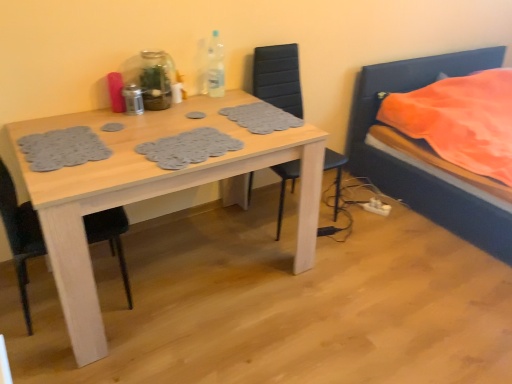
Question: From the image's perspective, is white plastic power plugs and sockets at lower right below black matte chair at left, which appears as the second chair when viewed from the right?

Choices:
 (A) no
 (B) yes

Answer: (B)

Question: From a real-world perspective, does white plastic power plugs and sockets at lower right stand above black matte chair at left, which ranks as the 1th chair in left-to-right order?

Choices:
 (A) no
 (B) yes

Answer: (A)

Question: Is white plastic power plugs and sockets at lower right positioned in front of black matte chair at left, which ranks as the 1th chair in left-to-right order?

Choices:
 (A) no
 (B) yes

Answer: (A)

Question: Does white plastic power plugs and sockets at lower right contain black matte chair at left, which appears as the second chair when viewed from the right?

Choices:
 (A) no
 (B) yes

Answer: (A)

Question: Is white plastic power plugs and sockets at lower right turned away from black matte chair at left, which appears as the second chair when viewed from the right?

Choices:
 (A) no
 (B) yes

Answer: (A)

Question: Considering the positions of metallic silver shaker at table center, the 3th bottle positioned from the right, and clear plastic bottle at upper center, the first bottle positioned from the right, in the image, is metallic silver shaker at table center, the 3th bottle positioned from the right, wider or thinner than clear plastic bottle at upper center, the first bottle positioned from the right,?

Choices:
 (A) thin
 (B) wide

Answer: (B)

Question: Considering the positions of metallic silver shaker at table center, the 3th bottle positioned from the right, and clear plastic bottle at upper center, the first bottle positioned from the right, in the image, is metallic silver shaker at table center, the 3th bottle positioned from the right, bigger or smaller than clear plastic bottle at upper center, the first bottle positioned from the right,?

Choices:
 (A) small
 (B) big

Answer: (A)

Question: From a real-world perspective, is metallic silver shaker at table center, acting as the 1th bottle starting from the left, positioned above or below clear plastic bottle at upper center, which is the third bottle from left to right?

Choices:
 (A) below
 (B) above

Answer: (A)

Question: In terms of height, does metallic silver shaker at table center, the 3th bottle positioned from the right, look taller or shorter compared to clear plastic bottle at upper center, which is the third bottle from left to right?

Choices:
 (A) short
 (B) tall

Answer: (A)

Question: From a real-world perspective, is white plastic power plugs and sockets at lower right positioned above or below metallic silver shaker at table center, the 3th bottle positioned from the right?

Choices:
 (A) below
 (B) above

Answer: (A)

Question: Is white plastic power plugs and sockets at lower right in front of or behind metallic silver shaker at table center, the 3th bottle positioned from the right, in the image?

Choices:
 (A) behind
 (B) front

Answer: (A)

Question: Would you say white plastic power plugs and sockets at lower right is to the left or to the right of metallic silver shaker at table center, the 3th bottle positioned from the right, in the picture?

Choices:
 (A) left
 (B) right

Answer: (B)

Question: Is white plastic power plugs and sockets at lower right spatially inside metallic silver shaker at table center, acting as the 1th bottle starting from the left, or outside of it?

Choices:
 (A) inside
 (B) outside

Answer: (B)

Question: Based on their sizes in the image, would you say clear plastic bottle at upper center, which is the third bottle from left to right, is bigger or smaller than transparent glass bottle at upper center, which ranks as the 2th bottle in right-to-left order?

Choices:
 (A) big
 (B) small

Answer: (B)

Question: Is clear plastic bottle at upper center, which is the third bottle from left to right, in front of or behind transparent glass bottle at upper center, which ranks as the 2th bottle in right-to-left order, in the image?

Choices:
 (A) behind
 (B) front

Answer: (A)